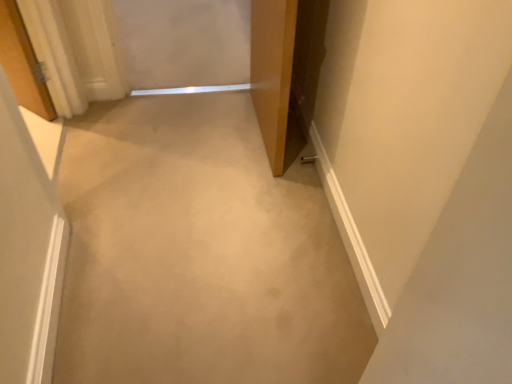
Question: Visually, is beige carpet at center positioned to the left or to the right of wooden door at center?

Choices:
 (A) left
 (B) right

Answer: (A)

Question: From the image's perspective, is beige carpet at center above or below wooden door at center?

Choices:
 (A) above
 (B) below

Answer: (B)

Question: Is beige carpet at center bigger or smaller than wooden door at center?

Choices:
 (A) small
 (B) big

Answer: (A)

Question: Considering the positions of point (283, 110) and point (221, 241), is point (283, 110) closer or farther from the camera than point (221, 241)?

Choices:
 (A) farther
 (B) closer

Answer: (A)

Question: From their relative heights in the image, would you say wooden door at center is taller or shorter than beige carpet at center?

Choices:
 (A) tall
 (B) short

Answer: (A)

Question: From the image's perspective, relative to beige carpet at center, is wooden door at center above or below?

Choices:
 (A) below
 (B) above

Answer: (B)

Question: Looking at their shapes, would you say wooden door at center is wider or thinner than beige carpet at center?

Choices:
 (A) wide
 (B) thin

Answer: (B)